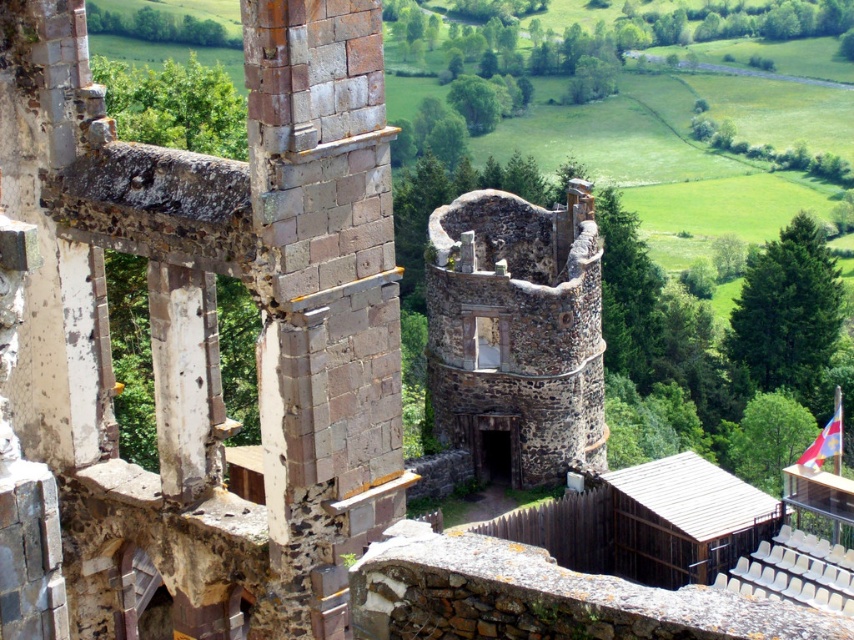
Question: Which of the following is the farthest from the observer?

Choices:
 (A) (262, 224)
 (B) (568, 195)

Answer: (B)

Question: Is rusty stone tower at center to the left of rustic stone tower at center from the viewer's perspective?

Choices:
 (A) yes
 (B) no

Answer: (A)

Question: Does rusty stone tower at center appear over rustic stone tower at center?

Choices:
 (A) no
 (B) yes

Answer: (A)

Question: Which of the following is the farthest from the observer?

Choices:
 (A) (326, 280)
 (B) (477, 280)

Answer: (B)

Question: Is rusty stone tower at center above rustic stone tower at center?

Choices:
 (A) yes
 (B) no

Answer: (B)